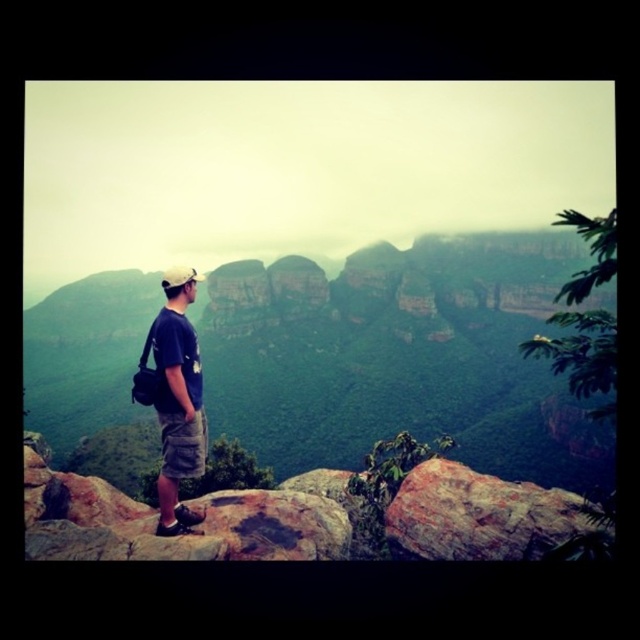
Question: Which object appears closest to the camera in this image?

Choices:
 (A) dark blue t-shirt at center
 (B) rugged stone mountain at center

Answer: (A)

Question: Is rugged stone mountain at center to the right of dark blue t-shirt at center from the viewer's perspective?

Choices:
 (A) yes
 (B) no

Answer: (B)

Question: Which of the following is the farthest from the observer?

Choices:
 (A) (522, 280)
 (B) (161, 314)

Answer: (A)

Question: Does rugged stone mountain at center have a larger size compared to dark blue t-shirt at center?

Choices:
 (A) yes
 (B) no

Answer: (A)

Question: Does rugged stone mountain at center lie in front of dark blue t-shirt at center?

Choices:
 (A) yes
 (B) no

Answer: (B)